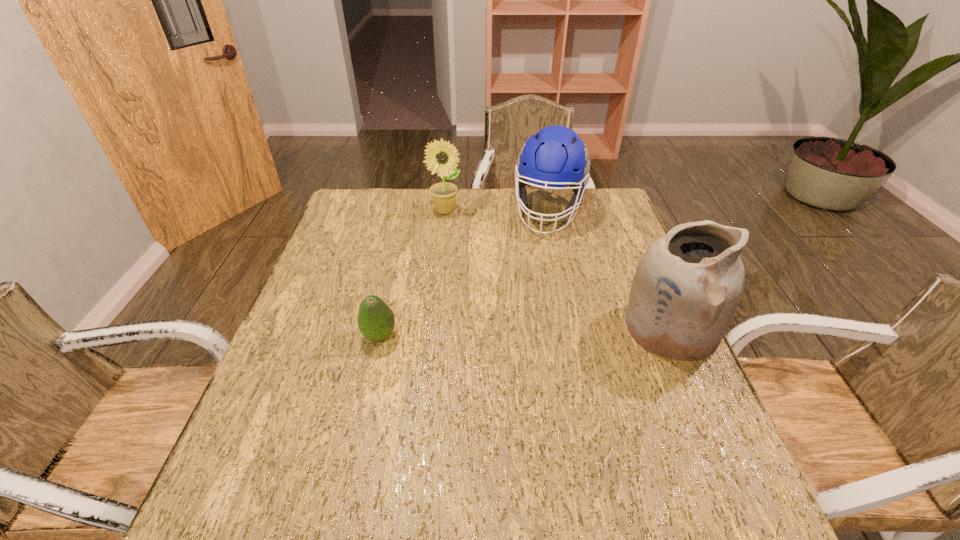
Locate an element on the screen. This screenshot has height=540, width=960. vacant area at the left edge is located at coordinates (320, 284).

Identify the location of free region at the right edge of the desktop. The height and width of the screenshot is (540, 960). (683, 416).

Locate an element on the screen. This screenshot has height=540, width=960. free space at the far right corner of the desktop is located at coordinates (568, 191).

Where is `free space between the pottery and the football helmet`? Image resolution: width=960 pixels, height=540 pixels. free space between the pottery and the football helmet is located at coordinates (610, 269).

This screenshot has width=960, height=540. In order to click on vacant area that lies between the pottery and the avocado in this screenshot , I will do `click(525, 332)`.

The width and height of the screenshot is (960, 540). In order to click on vacant point located between the third object from left to right and the rightmost object in this screenshot , I will do `click(610, 269)`.

Image resolution: width=960 pixels, height=540 pixels. I want to click on vacant space in between the rightmost object and the leftmost object, so click(x=525, y=332).

Locate an element on the screen. The width and height of the screenshot is (960, 540). empty location between the third object from left to right and the pottery is located at coordinates (610, 269).

Where is `vacant space that is in between the avocado and the sunflower`? The width and height of the screenshot is (960, 540). vacant space that is in between the avocado and the sunflower is located at coordinates (412, 274).

Locate an element on the screen. This screenshot has width=960, height=540. vacant region between the third object from right to left and the rightmost object is located at coordinates (558, 269).